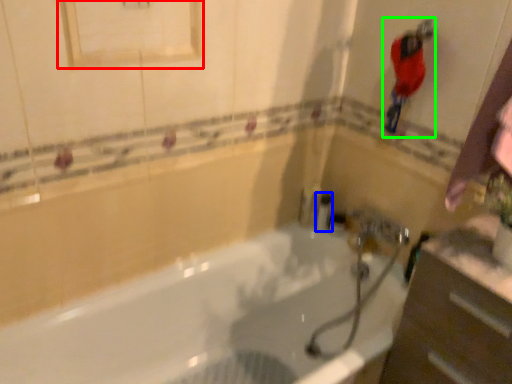
Question: Estimate the real-world distances between objects in this image. Which object is closer to medicine cabinet (highlighted by a red box), toiletry (highlighted by a blue box) or person (highlighted by a green box)?

Choices:
 (A) toiletry
 (B) person

Answer: (B)